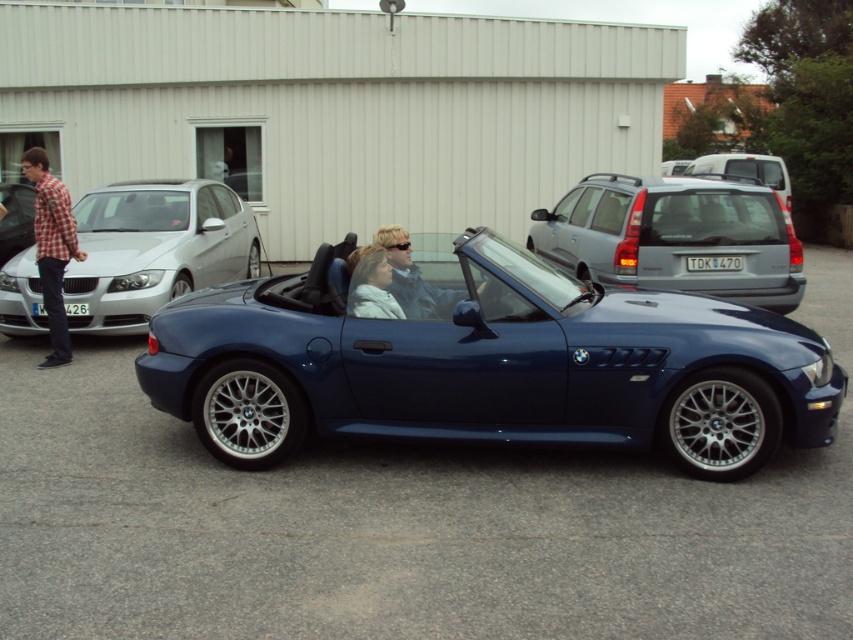
Is the position of satin silver metallic station wagon at right less distant than that of satin silver suv at center?

That is True.

Does satin silver metallic station wagon at right lie behind satin silver suv at center?

No.

Is point (705, 252) positioned before point (708, 163)?

Yes.

Find the location of a particular element. Image resolution: width=853 pixels, height=640 pixels. satin silver metallic station wagon at right is located at coordinates tap(675, 237).

Does satin silver metallic station wagon at right appear over matte white jacket at center?

Yes.

Based on the photo, which of these two, satin silver metallic station wagon at right or matte white jacket at center, stands shorter?

Standing shorter between the two is matte white jacket at center.

Find the location of `satin silver metallic station wagon at right`. satin silver metallic station wagon at right is located at coordinates (675, 237).

In the scene shown: Does matte white jacket at center have a greater height compared to satin silver suv at center?

No.

Is matte white jacket at center smaller than satin silver suv at center?

Correct, matte white jacket at center occupies less space than satin silver suv at center.

Is point (350, 282) positioned in front of point (695, 172)?

Yes, point (350, 282) is in front of point (695, 172).

The width and height of the screenshot is (853, 640). In order to click on matte white jacket at center in this screenshot , I will do `click(370, 285)`.